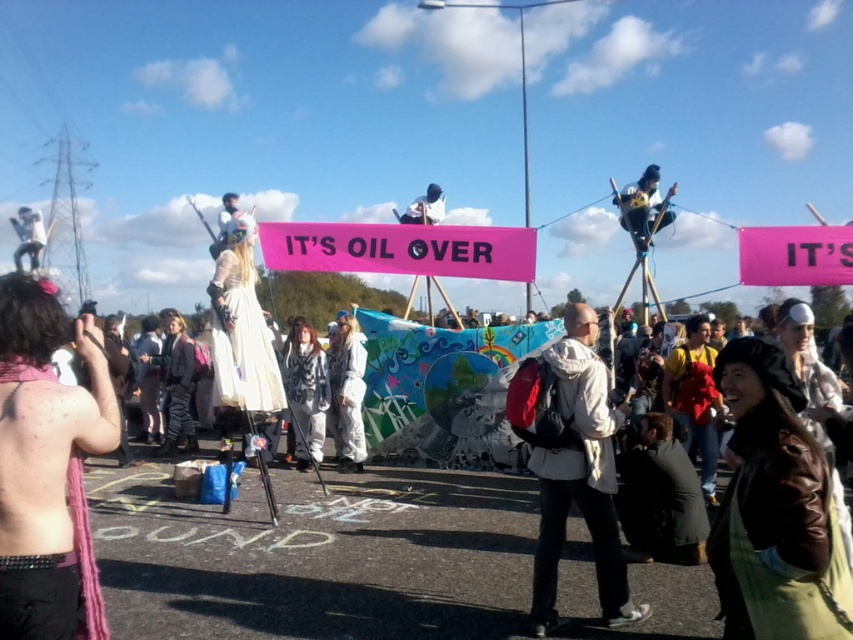
You are a photographer trying to capture the entire scene. You notice the white fabric figure at upper left and the matte black helmet at center. Which object should you adjust your camera angle to include first if you want to ensure both are fully in frame?

The white fabric figure at upper left is bigger than the matte black helmet at center, so you should adjust your camera angle to include the white fabric figure at upper left first to ensure both fit in the frame.

You are a photographer trying to capture the protest scene. You notice the white matte jacket at center and the pink fabric banner at upper center. Which object is narrower in width?

The white matte jacket at center is thinner than the pink fabric banner at upper center, so the white matte jacket at center is narrower in width.

You are a photographer trying to capture the entire scene of the protest. You notice the white fabric figure at upper left and the matte black helmet at center. Which object is closer to the camera?

The white fabric figure at upper left is closer to the camera because the matte black helmet at center is behind it.